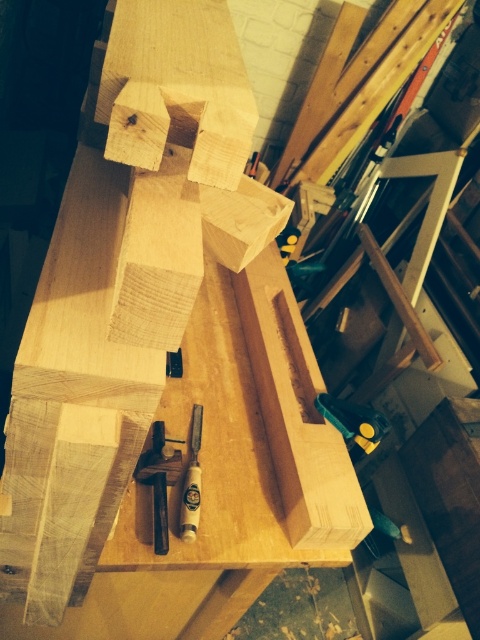
Question: Which point appears farthest from the camera in this image?

Choices:
 (A) (360, 422)
 (B) (158, 509)
 (C) (192, 496)

Answer: (A)

Question: Does metallic yellow clamp at lower right appear under wooden chisel at center?

Choices:
 (A) yes
 (B) no

Answer: (B)

Question: Is metallic yellow clamp at lower right above wooden chisel at center?

Choices:
 (A) no
 (B) yes

Answer: (B)

Question: Is metallic yellow clamp at lower right below wooden chisel at center?

Choices:
 (A) yes
 (B) no

Answer: (B)

Question: Among these objects, which one is farthest from the camera?

Choices:
 (A) wooden chisel at center
 (B) metallic yellow clamp at lower right

Answer: (B)

Question: Considering the real-world distances, which object is farthest from the wooden chisel at center?

Choices:
 (A) matte black chisel at center
 (B) metallic yellow clamp at lower right

Answer: (B)